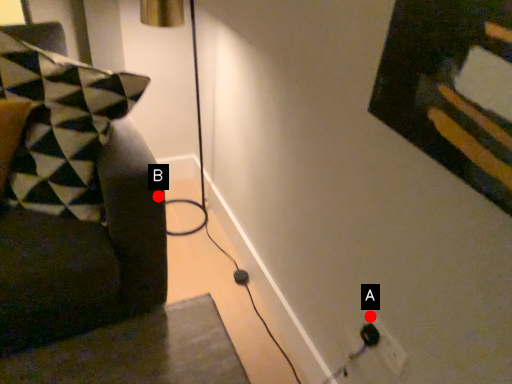
Question: Two points are circled on the image, labeled by A and B beside each circle. Which point is closer to the camera?

Choices:
 (A) A is closer
 (B) B is closer

Answer: (A)